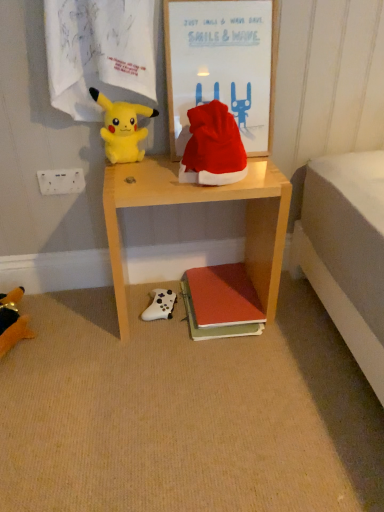
What are the coordinates of `vacant space that's between soft plush toy at lower left, positioned as the first toy in left-to-right order, and white matte game controller at lower center, which ranks as the 2th toy in bottom-to-top order` in the screenshot? It's located at (84, 325).